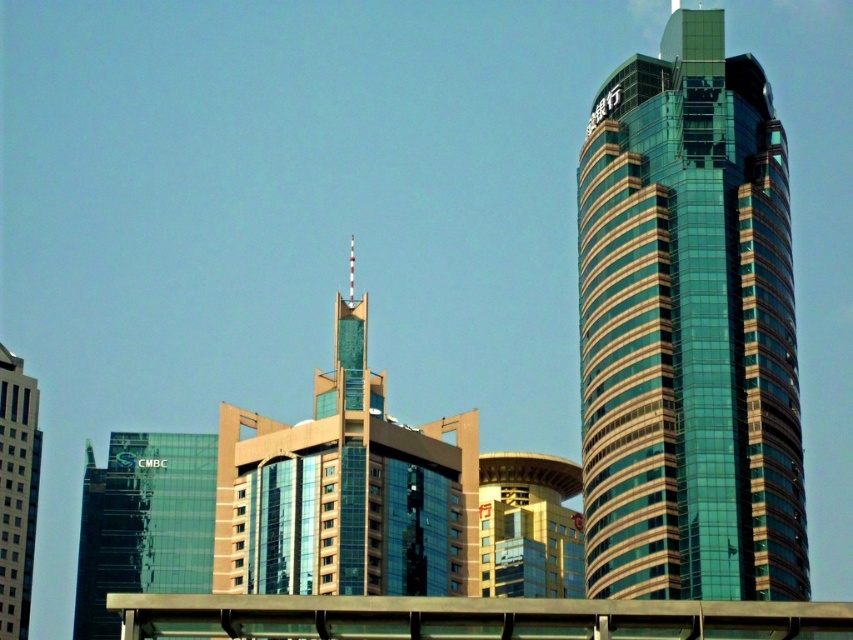
Question: Among these points, which one is nearest to the camera?

Choices:
 (A) (376, 449)
 (B) (577, 557)

Answer: (A)

Question: Which of these objects is positioned farthest from the transparent glass building at left?

Choices:
 (A) matte glass building at left
 (B) glassy teal tower at center
 (C) gold textured building at center

Answer: (C)

Question: Is green glass skyscraper at right to the left of transparent glass building at left from the viewer's perspective?

Choices:
 (A) no
 (B) yes

Answer: (A)

Question: Which point is closer to the camera?

Choices:
 (A) gold textured building at center
 (B) glassy teal tower at center
 (C) matte glass building at left
 (D) green glass skyscraper at right

Answer: (D)

Question: Observing the image, what is the correct spatial positioning of green glass skyscraper at right in reference to matte glass building at left?

Choices:
 (A) left
 (B) right

Answer: (B)

Question: Can you confirm if transparent glass building at left is smaller than matte glass building at left?

Choices:
 (A) no
 (B) yes

Answer: (A)